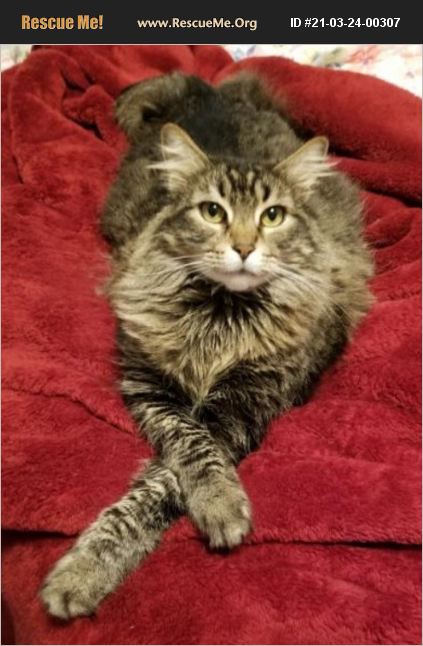
Locate an element on the screen. blanket is located at coordinates (355, 449), (40, 242), (136, 57).